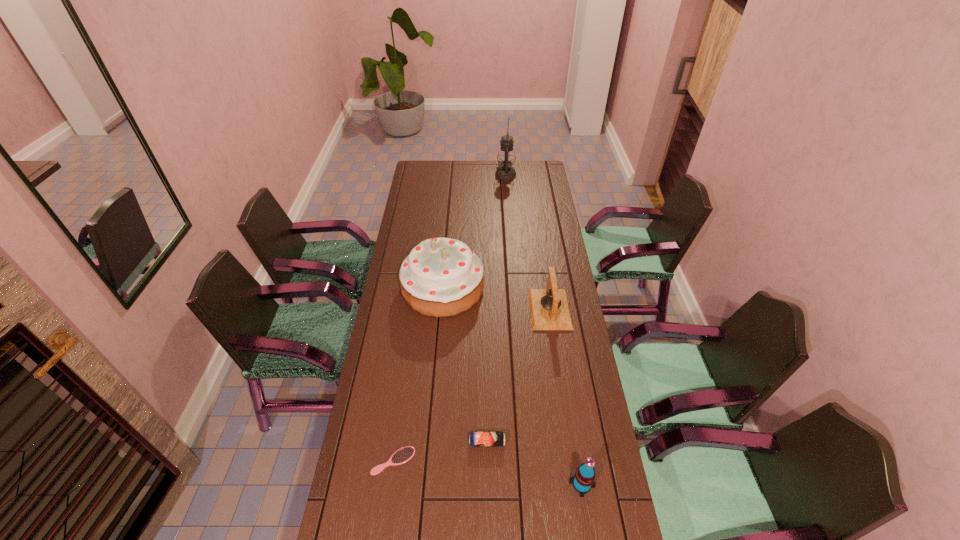
Identify the location of empty location between the bell and the cake. The image size is (960, 540). (496, 299).

Identify the location of object that is the fourth nearest to the bell. The image size is (960, 540). (404, 454).

This screenshot has width=960, height=540. I want to click on object that is the fourth closest to the shortest object, so click(x=549, y=309).

You are a GUI agent. You are given a task and a screenshot of the screen. Output one action in this format:
    pyautogui.click(x=<x>, y=<y>)
    Task: Click on the vacant space that satisfies the following two spatial constraints: 1. on the front side of the bell; 2. on the left side of the fifth shortest object
    Image resolution: width=960 pixels, height=540 pixels.
    Given the screenshot: What is the action you would take?
    pyautogui.click(x=441, y=309)

Locate an element on the screen. The height and width of the screenshot is (540, 960). free location that satisfies the following two spatial constraints: 1. on the back side of the second shortest object; 2. on the left side of the farthest object is located at coordinates (484, 175).

Where is `vacant region that satisfies the following two spatial constraints: 1. on the back side of the tallest object; 2. on the right side of the cake`? vacant region that satisfies the following two spatial constraints: 1. on the back side of the tallest object; 2. on the right side of the cake is located at coordinates (452, 175).